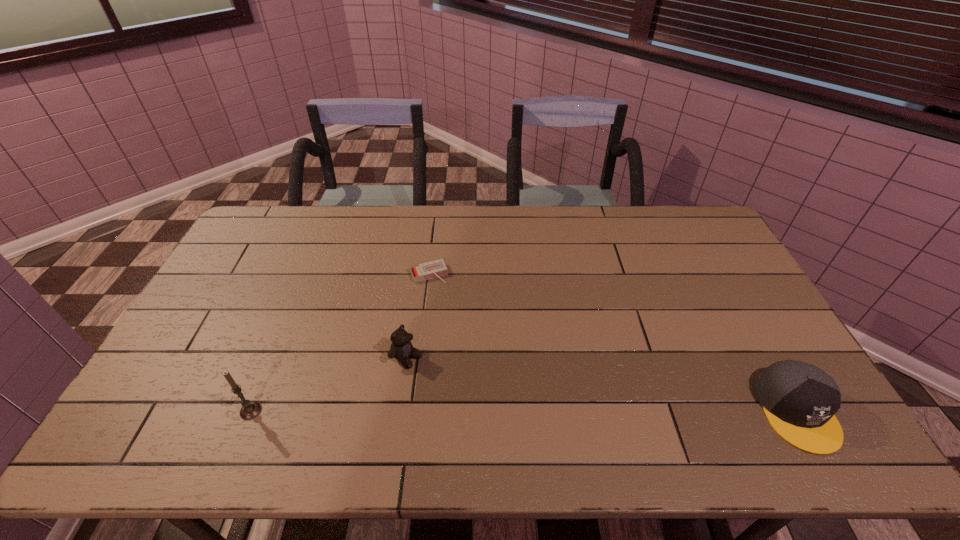
Locate an element on the screen. The height and width of the screenshot is (540, 960). free space located 0.320m on the striking surface of the matchbox is located at coordinates (468, 360).

Identify the location of vacant space situated on the striking surface of the matchbox. This screenshot has width=960, height=540. (463, 348).

Image resolution: width=960 pixels, height=540 pixels. Find the location of `vacant region located on the striking surface of the matchbox`. vacant region located on the striking surface of the matchbox is located at coordinates (464, 351).

Find the location of a particular element. The height and width of the screenshot is (540, 960). candle situated at the near edge is located at coordinates (250, 410).

The height and width of the screenshot is (540, 960). Identify the location of cap that is positioned at the near edge. (800, 400).

The image size is (960, 540). I want to click on object present at the right edge, so click(800, 400).

Locate an element on the screen. The image size is (960, 540). object located in the near right corner section of the desktop is located at coordinates (800, 400).

The height and width of the screenshot is (540, 960). I want to click on vacant space at the far edge, so click(343, 237).

This screenshot has width=960, height=540. Identify the location of vacant space at the left edge of the desktop. (244, 276).

Locate an element on the screen. The height and width of the screenshot is (540, 960). vacant area at the right edge is located at coordinates pyautogui.click(x=734, y=363).